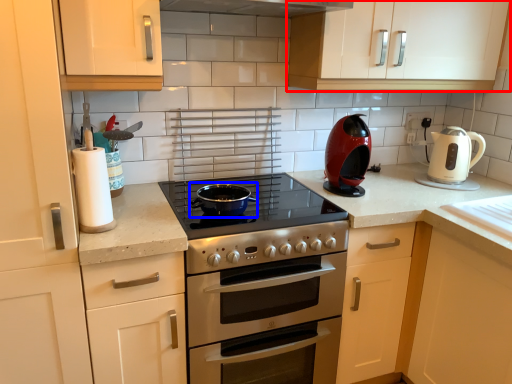
Question: Which of the following is the farthest to the observer, cabinetry (highlighted by a red box) or wok (highlighted by a blue box)?

Choices:
 (A) cabinetry
 (B) wok

Answer: (A)